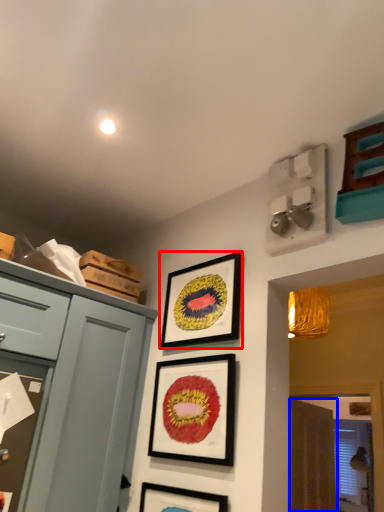
Question: Which of the following is the closest to the observer, picture frame (highlighted by a red box) or curtain (highlighted by a blue box)?

Choices:
 (A) picture frame
 (B) curtain

Answer: (A)